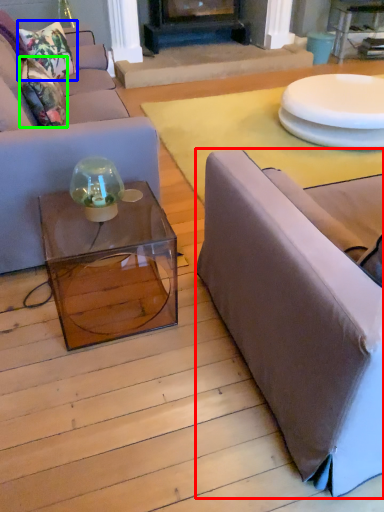
Question: Which is nearer to the studio couch (highlighted by a red box)? pillow (highlighted by a blue box) or pillow (highlighted by a green box).

Choices:
 (A) pillow
 (B) pillow

Answer: (B)